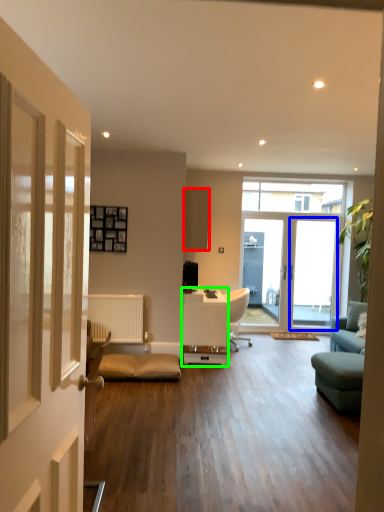
Question: Which is farther away from cabinetry (highlighted by a red box)? screen door (highlighted by a blue box) or desk (highlighted by a green box)?

Choices:
 (A) screen door
 (B) desk

Answer: (A)